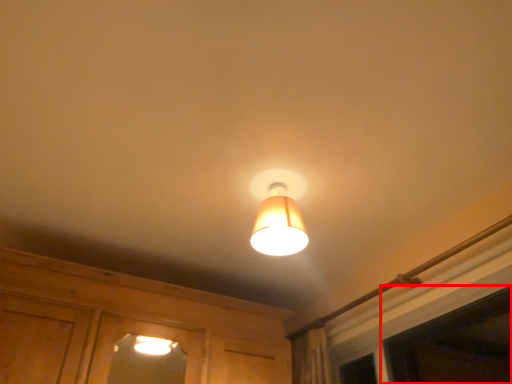
Question: From the image, what is the correct spatial relationship of window (annotated by the red box) in relation to lamp?

Choices:
 (A) left
 (B) right

Answer: (B)